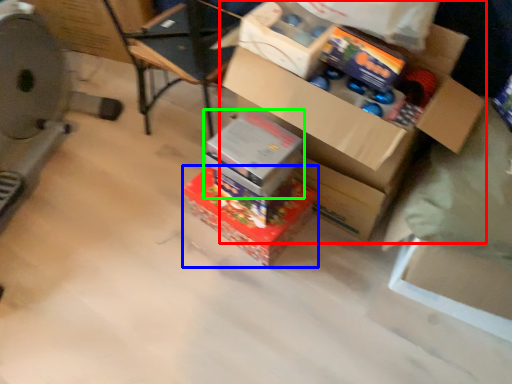
Question: Based on their relative distances, which object is nearer to box (highlighted by a red box)? Choose from box (highlighted by a blue box) and box (highlighted by a green box).

Choices:
 (A) box
 (B) box

Answer: (B)